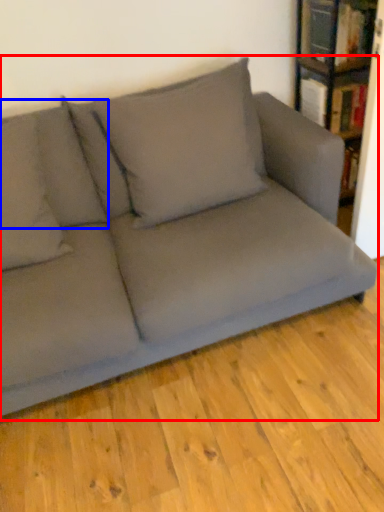
Question: Which object appears closest to the camera in this image, studio couch (highlighted by a red box) or pillow (highlighted by a blue box)?

Choices:
 (A) studio couch
 (B) pillow

Answer: (A)